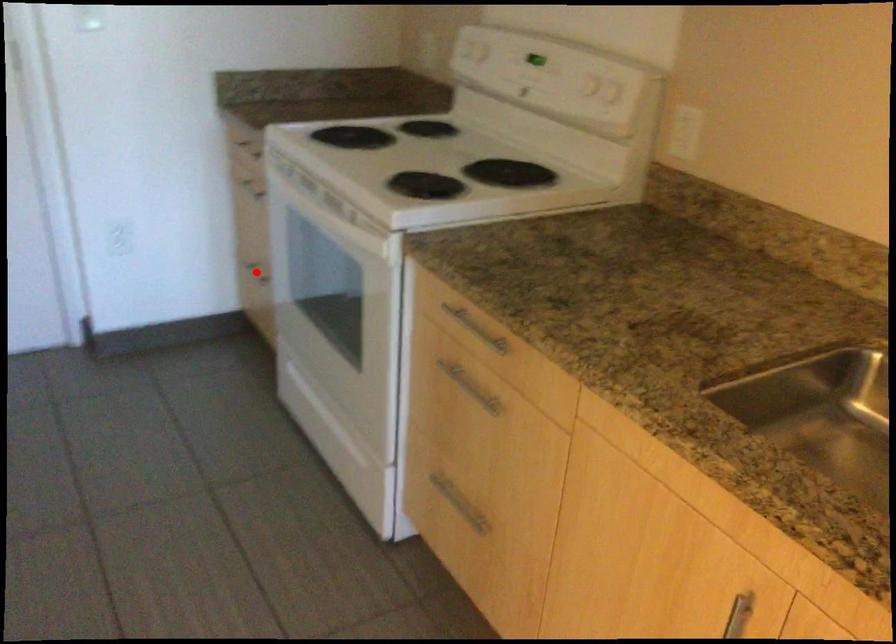
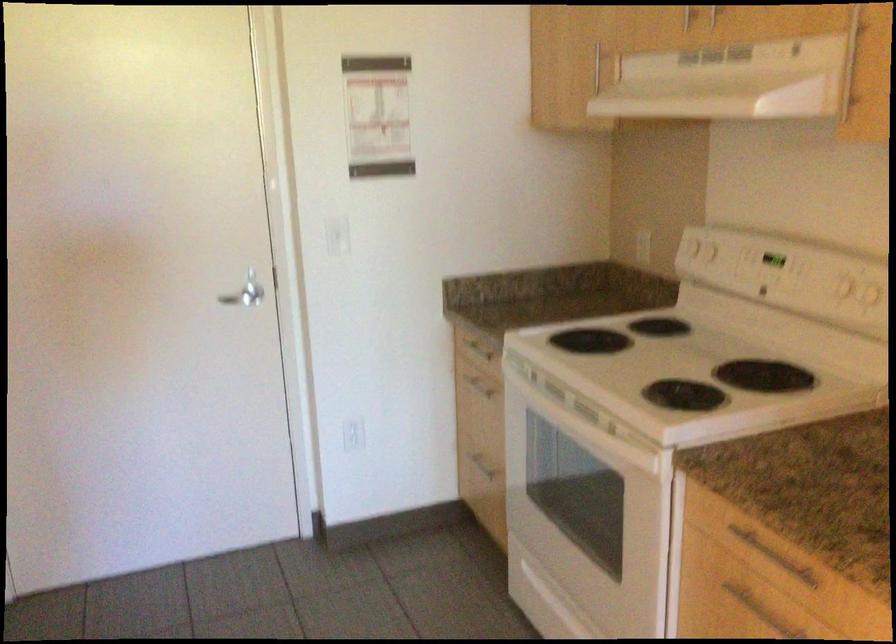
Where in the second image is the point corresponding to the highlighted location from the first image?

(478, 462)